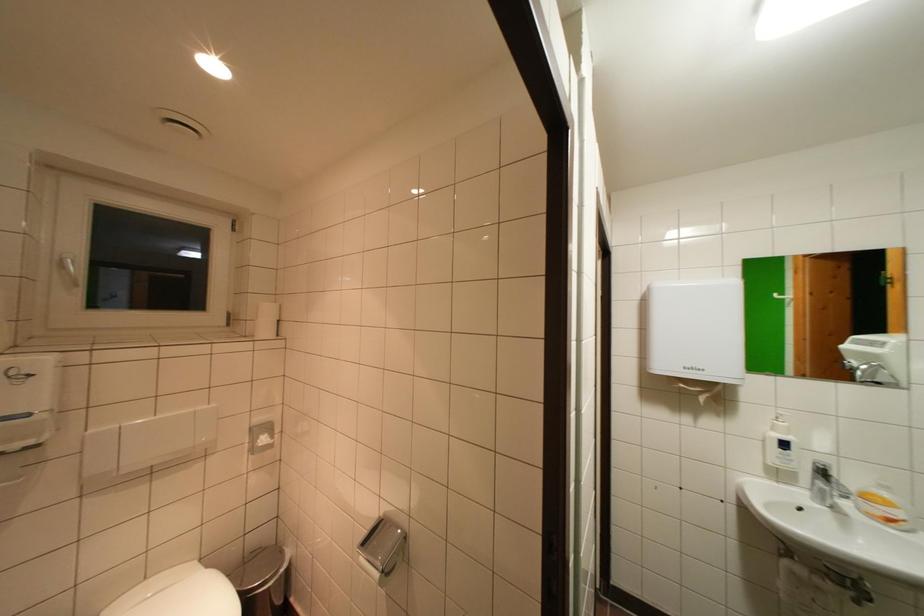
Which object does [259,569] point to?

It refers to a metal trash can.